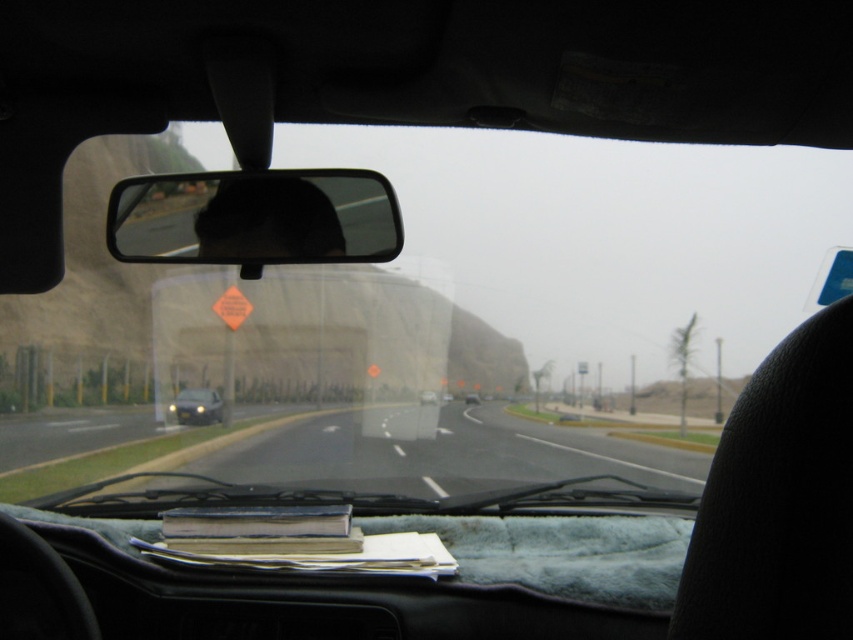
Question: Observing the image, what is the correct spatial positioning of black asphalt road at center in reference to black glossy rearview mirror at center?

Choices:
 (A) left
 (B) right

Answer: (A)

Question: Is black asphalt road at center thinner than black glossy rearview mirror at center?

Choices:
 (A) yes
 (B) no

Answer: (B)

Question: Does black asphalt road at center have a lesser width compared to black glossy rearview mirror at center?

Choices:
 (A) yes
 (B) no

Answer: (B)

Question: Which object is the farthest from the matte silver sedan at center?

Choices:
 (A) black glossy rearview mirror at center
 (B) black asphalt road at center
 (C) transparent glass windshield at center

Answer: (A)

Question: Estimate the real-world distances between objects in this image. Which object is farther from the black glossy rearview mirror at center?

Choices:
 (A) black asphalt road at center
 (B) matte silver sedan at center

Answer: (B)

Question: Estimate the real-world distances between objects in this image. Which object is farther from the black glossy rearview mirror at center?

Choices:
 (A) matte silver sedan at center
 (B) transparent glass windshield at center
 (C) black asphalt road at center

Answer: (A)